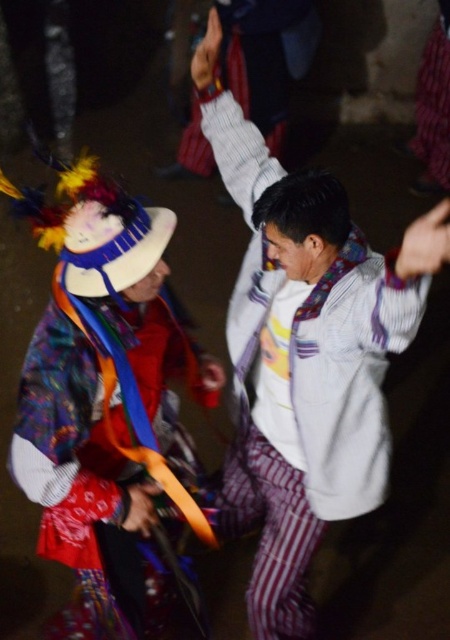
Consider the image. Is white striped shirt at center above velvet purple scarf at upper right?

No, white striped shirt at center is not above velvet purple scarf at upper right.

Is white striped shirt at center to the left of velvet purple scarf at upper right from the viewer's perspective?

Indeed, white striped shirt at center is positioned on the left side of velvet purple scarf at upper right.

Is point (241, 205) closer to viewer compared to point (431, 106)?

Yes, it is.

Locate an element on the screen. This screenshot has height=640, width=450. white striped shirt at center is located at coordinates (306, 353).

Can you confirm if white striped shirt at center is bigger than multicolored woven fabric at left?

Indeed, white striped shirt at center has a larger size compared to multicolored woven fabric at left.

Between white striped shirt at center and multicolored woven fabric at left, which one appears on the right side from the viewer's perspective?

From the viewer's perspective, white striped shirt at center appears more on the right side.

Between point (283, 600) and point (21, 481), which one is positioned behind?

Point (283, 600)

This screenshot has height=640, width=450. Identify the location of white striped shirt at center. (306, 353).

Can you confirm if multicolored woven fabric at left is bigger than velvet purple scarf at upper right?

Yes, multicolored woven fabric at left is bigger than velvet purple scarf at upper right.

Where is `multicolored woven fabric at left`? Image resolution: width=450 pixels, height=640 pixels. multicolored woven fabric at left is located at coordinates (108, 449).

What do you see at coordinates (108, 449) in the screenshot?
I see `multicolored woven fabric at left` at bounding box center [108, 449].

Where is `multicolored woven fabric at left`? multicolored woven fabric at left is located at coordinates (108, 449).